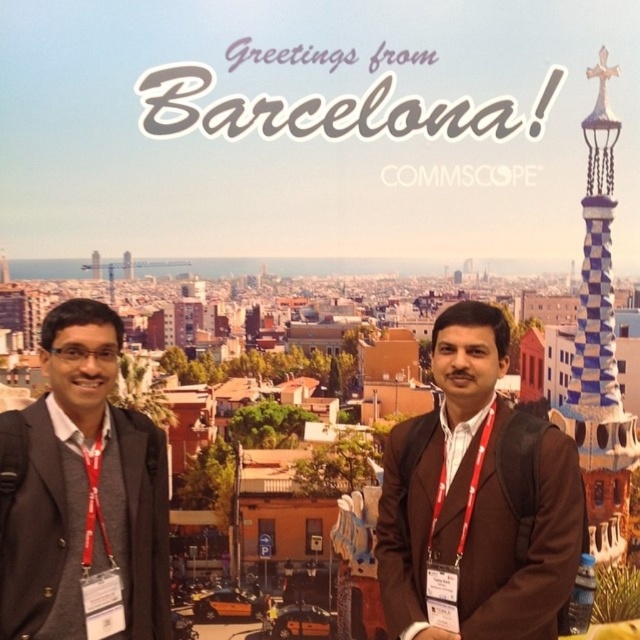
Who is shorter, brown matte jacket at center or dark gray suit at left?

dark gray suit at left is shorter.

Does point (572, 486) come behind point (145, 445)?

That is False.

Identify the location of brown matte jacket at center. The image size is (640, 640). (477, 497).